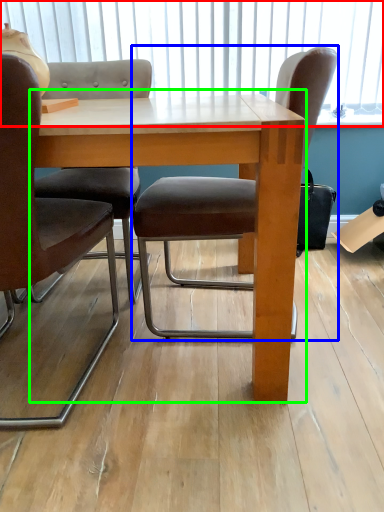
Question: Which object is positioned farthest from window screen (highlighted by a red box)? Select from chair (highlighted by a blue box) and table (highlighted by a green box).

Choices:
 (A) chair
 (B) table

Answer: (B)